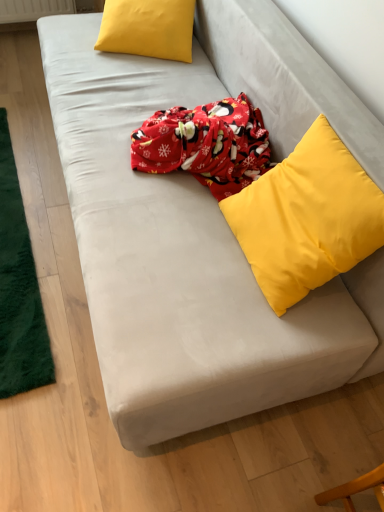
Question: Based on their sizes in the image, would you say matte yellow pillow at upper left, which ranks as the second pillow in front-to-back order, is bigger or smaller than green plush mat at left?

Choices:
 (A) big
 (B) small

Answer: (A)

Question: Considering the positions of point (187, 49) and point (1, 307), is point (187, 49) closer or farther from the camera than point (1, 307)?

Choices:
 (A) farther
 (B) closer

Answer: (A)

Question: Which object is the closest to the matte yellow pillow at upper left, which appears as the first pillow when viewed from the top?

Choices:
 (A) yellow matte pillow at upper right, which ranks as the first pillow in right-to-left order
 (B) green plush mat at left

Answer: (B)

Question: Which is farther from the yellow matte pillow at upper right, the first pillow from the front?

Choices:
 (A) matte yellow pillow at upper left, which ranks as the second pillow in front-to-back order
 (B) green plush mat at left

Answer: (A)